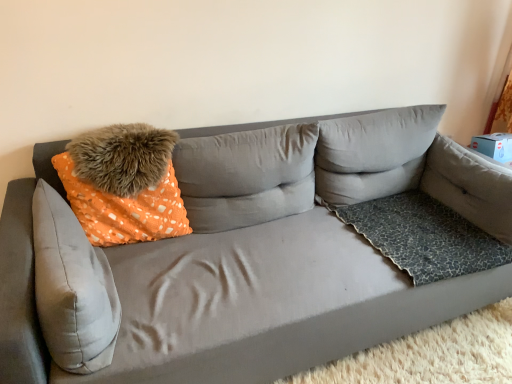
Question: Is suede gray couch at center at the left side of suede gray pillow at left, acting as the fifth pillow starting from the right?

Choices:
 (A) no
 (B) yes

Answer: (A)

Question: Can you confirm if suede gray couch at center is bigger than suede gray pillow at left, acting as the fifth pillow starting from the right?

Choices:
 (A) no
 (B) yes

Answer: (B)

Question: Can you confirm if suede gray couch at center is taller than suede gray pillow at left, acting as the first pillow starting from the left?

Choices:
 (A) yes
 (B) no

Answer: (A)

Question: Considering the relative sizes of suede gray couch at center and suede gray pillow at left, acting as the fifth pillow starting from the right, in the image provided, is suede gray couch at center wider than suede gray pillow at left, acting as the fifth pillow starting from the right,?

Choices:
 (A) yes
 (B) no

Answer: (A)

Question: Is suede gray couch at center further to the viewer compared to suede gray pillow at left, acting as the fifth pillow starting from the right?

Choices:
 (A) no
 (B) yes

Answer: (A)

Question: Is suede gray couch at center smaller than suede gray pillow at left, acting as the fifth pillow starting from the right?

Choices:
 (A) no
 (B) yes

Answer: (A)

Question: Is gray fabric pillow at upper right, the 4th pillow when ordered from left to right, inside orange dotted fabric pillow at upper center, which is the 3th pillow in left-to-right order?

Choices:
 (A) yes
 (B) no

Answer: (B)

Question: From a real-world perspective, is orange dotted fabric pillow at upper center, the 3th pillow positioned from the right, below gray fabric pillow at upper right, the 2th pillow in the right-to-left sequence?

Choices:
 (A) no
 (B) yes

Answer: (B)

Question: Considering the relative sizes of orange dotted fabric pillow at upper center, which is the 3th pillow in left-to-right order, and gray fabric pillow at upper right, the 4th pillow when ordered from left to right, in the image provided, is orange dotted fabric pillow at upper center, which is the 3th pillow in left-to-right order, taller than gray fabric pillow at upper right, the 4th pillow when ordered from left to right,?

Choices:
 (A) no
 (B) yes

Answer: (B)

Question: Is orange dotted fabric pillow at upper center, the 3th pillow positioned from the right, shorter than gray fabric pillow at upper right, the 2th pillow in the right-to-left sequence?

Choices:
 (A) yes
 (B) no

Answer: (B)

Question: Is orange dotted fabric pillow at upper center, the 3th pillow positioned from the right, positioned before gray fabric pillow at upper right, the 4th pillow when ordered from left to right?

Choices:
 (A) no
 (B) yes

Answer: (B)

Question: Considering the relative positions of orange dotted fabric pillow at upper center, which is the 3th pillow in left-to-right order, and gray fabric pillow at upper right, the 2th pillow in the right-to-left sequence, in the image provided, is orange dotted fabric pillow at upper center, which is the 3th pillow in left-to-right order, behind gray fabric pillow at upper right, the 2th pillow in the right-to-left sequence,?

Choices:
 (A) yes
 (B) no

Answer: (B)

Question: Is leopard print fabric pillow at right, the 5th pillow in the left-to-right sequence, behind gray fabric pillow at upper right, the 2th pillow in the right-to-left sequence?

Choices:
 (A) no
 (B) yes

Answer: (A)